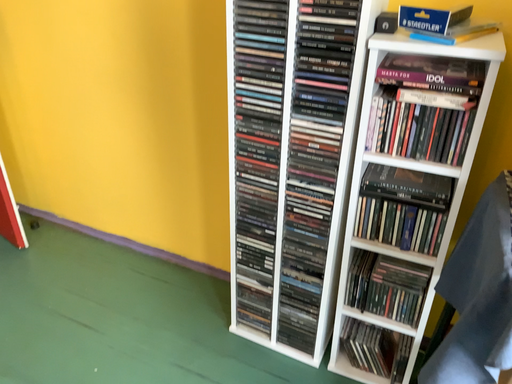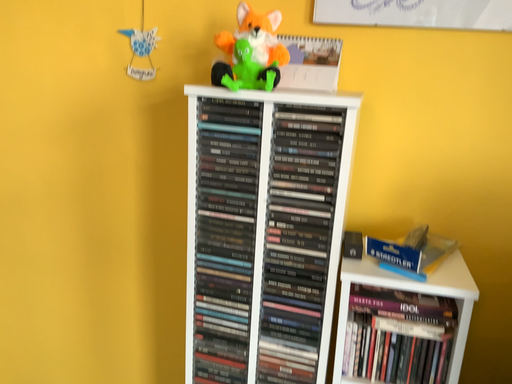
Question: How did the camera likely rotate when shooting the video?

Choices:
 (A) rotated right
 (B) rotated left

Answer: (A)